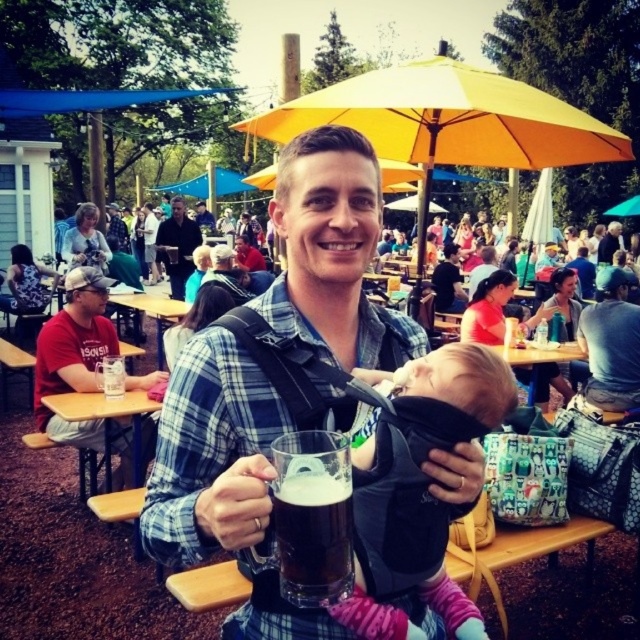
Question: Is the position of yellow fabric umbrella at upper center less distant than that of soft pink fabric baby at center?

Choices:
 (A) no
 (B) yes

Answer: (A)

Question: Among these objects, which one is nearest to the camera?

Choices:
 (A) smooth black shirt at center
 (B) translucent glass mug at center
 (C) dark matte glass mug at center
 (D) matte black shirt at center

Answer: (C)

Question: Can you confirm if dark matte glass mug at center is thinner than gray fabric shirt at upper right?

Choices:
 (A) yes
 (B) no

Answer: (A)

Question: Which of the following is the closest to the observer?

Choices:
 (A) blue plaid shirt at center
 (B) gray fabric shirt at upper right
 (C) matte black shirt at upper center

Answer: (A)

Question: From the image, what is the correct spatial relationship of dark matte glass mug at center in relation to gray fabric shirt at upper right?

Choices:
 (A) right
 (B) left

Answer: (B)

Question: Which point is closer to the camera?

Choices:
 (A) (92, 296)
 (B) (602, 260)

Answer: (A)